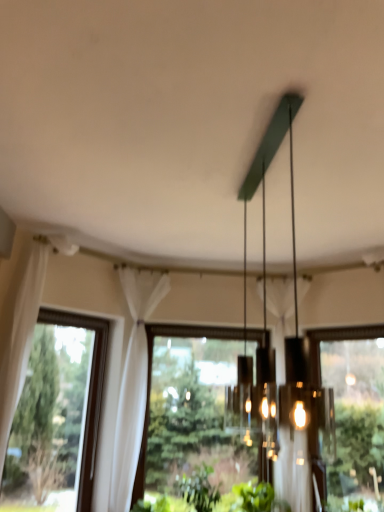
Question: Is green leafy plant at lower center touching transparent glass window at center, positioned as the second window in right-to-left order?

Choices:
 (A) yes
 (B) no

Answer: (B)

Question: From the image's perspective, does green leafy plant at lower center appear lower than transparent glass window at center, positioned as the 2th window in left-to-right order?

Choices:
 (A) no
 (B) yes

Answer: (B)

Question: Is green leafy plant at lower center thinner than transparent glass window at center, positioned as the second window in right-to-left order?

Choices:
 (A) no
 (B) yes

Answer: (A)

Question: Is green leafy plant at lower center taller than transparent glass window at center, positioned as the second window in right-to-left order?

Choices:
 (A) no
 (B) yes

Answer: (A)

Question: Is green leafy plant at lower center looking in the opposite direction of transparent glass window at center, positioned as the second window in right-to-left order?

Choices:
 (A) yes
 (B) no

Answer: (A)

Question: From a real-world perspective, is transparent glass window at center, positioned as the second window in right-to-left order, positioned above or below transparent glass window at right, placed as the first window when sorted from right to left?

Choices:
 (A) below
 (B) above

Answer: (A)

Question: Based on their positions, is transparent glass window at center, positioned as the second window in right-to-left order, located to the left or right of transparent glass window at right, which appears as the 3th window when viewed from the left?

Choices:
 (A) left
 (B) right

Answer: (A)

Question: Does point (183, 437) appear closer or farther from the camera than point (367, 349)?

Choices:
 (A) closer
 (B) farther

Answer: (A)

Question: Is transparent glass window at center, positioned as the second window in right-to-left order, situated inside transparent glass window at right, placed as the first window when sorted from right to left, or outside?

Choices:
 (A) outside
 (B) inside

Answer: (A)

Question: Considering the relative positions of green leafy plant at lower center and matte green chandelier at center in the image provided, is green leafy plant at lower center to the left or to the right of matte green chandelier at center?

Choices:
 (A) right
 (B) left

Answer: (B)

Question: Relative to matte green chandelier at center, is green leafy plant at lower center in front or behind?

Choices:
 (A) behind
 (B) front

Answer: (A)

Question: Is point (196, 494) closer or farther from the camera than point (278, 103)?

Choices:
 (A) farther
 (B) closer

Answer: (A)

Question: Considering the positions of green leafy plant at lower center and matte green chandelier at center in the image, is green leafy plant at lower center wider or thinner than matte green chandelier at center?

Choices:
 (A) wide
 (B) thin

Answer: (A)

Question: From the image's perspective, is matte green chandelier at center above or below transparent glass window at right, which appears as the 3th window when viewed from the left?

Choices:
 (A) above
 (B) below

Answer: (A)

Question: From a real-world perspective, relative to transparent glass window at right, placed as the first window when sorted from right to left, is matte green chandelier at center vertically above or below?

Choices:
 (A) below
 (B) above

Answer: (B)